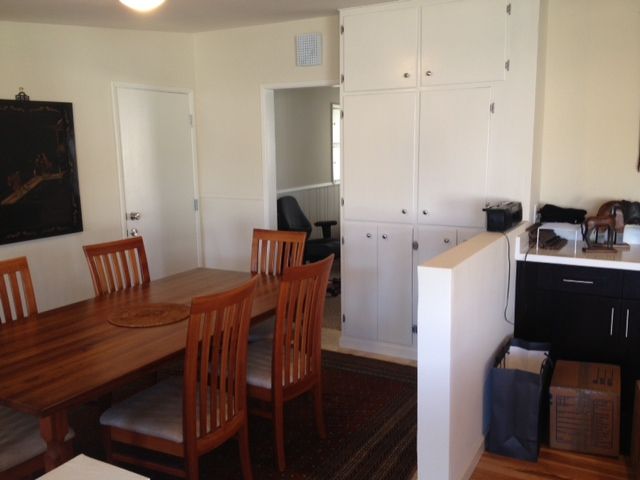
Find the location of a particular element. brown area rug is located at coordinates (317, 454).